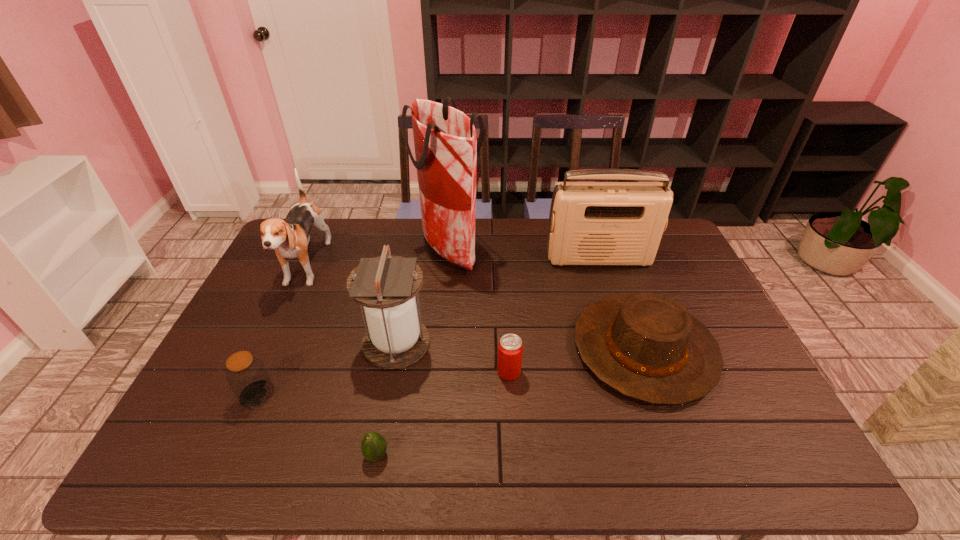
Identify the location of object that stands as the fourth closest to the tallest object. (290, 238).

Identify which object is the third closest to the tallest object. Please provide its 2D coordinates. Your answer should be formatted as a tuple, i.e. [(x, y)], where the tuple contains the x and y coordinates of a point satisfying the conditions above.

[(646, 346)]

Locate an element on the screen. vacant space that satisfies the following two spatial constraints: 1. on the front-facing side of the radio receiver; 2. on the right side of the cowboy hat is located at coordinates (628, 348).

In order to click on blank space that satisfies the following two spatial constraints: 1. on the back side of the avocado; 2. on the left side of the cowboy hat in this screenshot , I will do `click(396, 348)`.